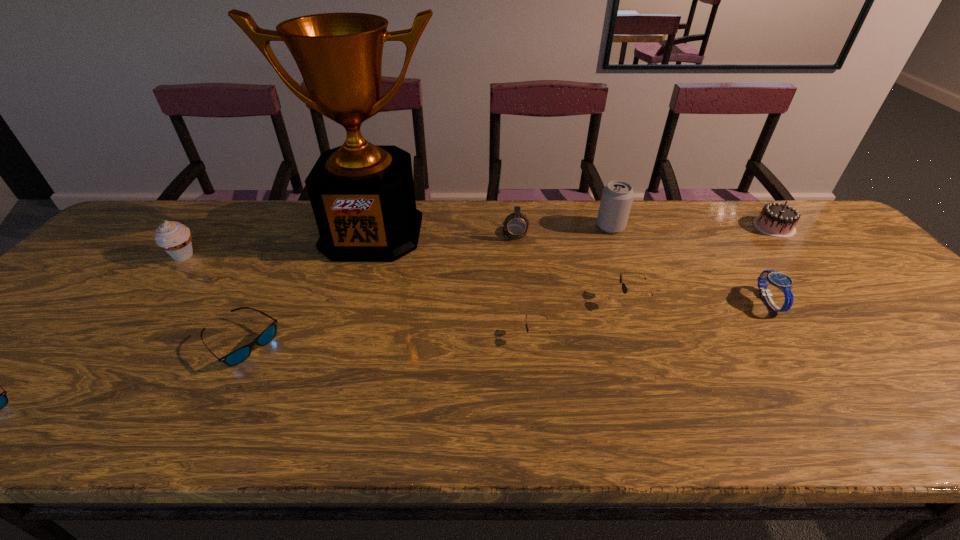
Locate an element on the screen. Image resolution: width=960 pixels, height=540 pixels. watch is located at coordinates (782, 281).

Find the location of `the left black sunglasses`. the left black sunglasses is located at coordinates [x=527, y=329].

This screenshot has height=540, width=960. In order to click on the second tallest sunglasses in this screenshot , I will do `click(527, 329)`.

What are the coordinates of `the ninth tallest object` in the screenshot? It's located at (236, 357).

Where is `the right blue sunglasses`? This screenshot has height=540, width=960. the right blue sunglasses is located at coordinates (236, 357).

This screenshot has width=960, height=540. I want to click on vacant area located on the front of the gold trophy cup with the label, so click(x=335, y=350).

Locate an element on the screen. free space located on the right of the can is located at coordinates 687,227.

You are a GUI agent. You are given a task and a screenshot of the screen. Output one action in this format:
    pyautogui.click(x=<x>, y=<y>)
    Task: Click on the vacant space located 0.080m on the front of the muffin
    
    Given the screenshot: What is the action you would take?
    pyautogui.click(x=160, y=285)

Find the location of a particular element. vacant position located 0.180m on the face of the compass is located at coordinates (520, 282).

Image resolution: width=960 pixels, height=540 pixels. In order to click on vacant region located 0.120m on the front of the rightmost object in this screenshot , I will do `click(806, 264)`.